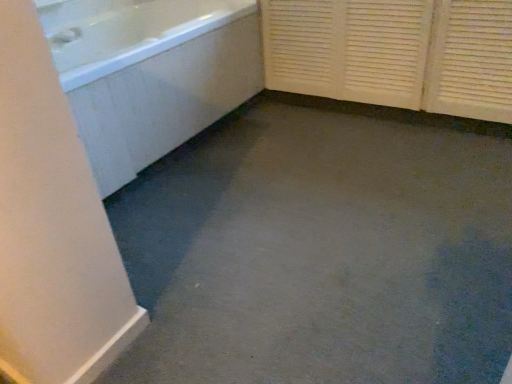
Question: Is white textured screen door at right directly adjacent to white glossy bathtub at upper left?

Choices:
 (A) yes
 (B) no

Answer: (B)

Question: Does white textured screen door at right have a smaller size compared to white glossy bathtub at upper left?

Choices:
 (A) yes
 (B) no

Answer: (A)

Question: Could white glossy bathtub at upper left be considered to be inside white textured screen door at right?

Choices:
 (A) yes
 (B) no

Answer: (B)

Question: Is white textured screen door at right to the left of white glossy bathtub at upper left from the viewer's perspective?

Choices:
 (A) no
 (B) yes

Answer: (A)

Question: Would you say white textured screen door at right is outside white glossy bathtub at upper left?

Choices:
 (A) yes
 (B) no

Answer: (A)

Question: Are white textured screen door at right and white glossy bathtub at upper left far apart?

Choices:
 (A) yes
 (B) no

Answer: (B)

Question: From the image's perspective, is white glossy bathtub at upper left above white glossy faucet at upper left?

Choices:
 (A) no
 (B) yes

Answer: (A)

Question: Is white glossy bathtub at upper left positioned behind white glossy faucet at upper left?

Choices:
 (A) yes
 (B) no

Answer: (B)

Question: Is white glossy bathtub at upper left thinner than white glossy faucet at upper left?

Choices:
 (A) no
 (B) yes

Answer: (A)

Question: Is white glossy bathtub at upper left bigger than white glossy faucet at upper left?

Choices:
 (A) no
 (B) yes

Answer: (B)

Question: Is white glossy bathtub at upper left oriented away from white glossy faucet at upper left?

Choices:
 (A) yes
 (B) no

Answer: (A)

Question: Is white glossy bathtub at upper left facing towards white glossy faucet at upper left?

Choices:
 (A) yes
 (B) no

Answer: (B)

Question: Can you confirm if white glossy faucet at upper left is bigger than white glossy bathtub at upper left?

Choices:
 (A) no
 (B) yes

Answer: (A)